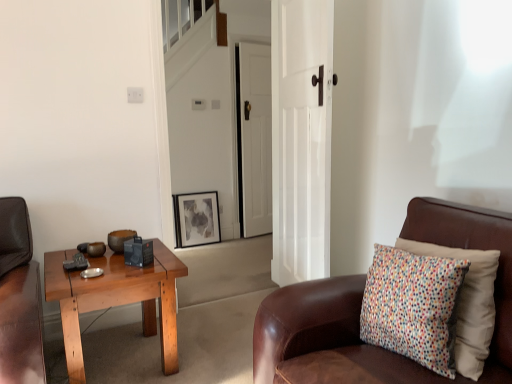
Question: Would you say white wooden door at center, which is the 2th door in front-to-back order, is a long distance from white glossy door at center, placed as the 2th door when sorted from back to front?

Choices:
 (A) yes
 (B) no

Answer: (A)

Question: Is white wooden door at center, which appears as the first door when viewed from the back, placed right next to white glossy door at center, positioned as the first door in front-to-back order?

Choices:
 (A) no
 (B) yes

Answer: (A)

Question: From the image's perspective, is white wooden door at center, which appears as the first door when viewed from the back, on top of white glossy door at center, positioned as the first door in front-to-back order?

Choices:
 (A) no
 (B) yes

Answer: (B)

Question: Is the position of white wooden door at center, which is the 2th door in front-to-back order, less distant than that of white glossy door at center, positioned as the first door in front-to-back order?

Choices:
 (A) yes
 (B) no

Answer: (B)

Question: From the image's perspective, is white wooden door at center, which is the 2th door in front-to-back order, under white glossy door at center, placed as the 2th door when sorted from back to front?

Choices:
 (A) no
 (B) yes

Answer: (A)

Question: Considering the relative sizes of white wooden door at center, which is the 2th door in front-to-back order, and white glossy door at center, positioned as the first door in front-to-back order, in the image provided, is white wooden door at center, which is the 2th door in front-to-back order, taller than white glossy door at center, positioned as the first door in front-to-back order,?

Choices:
 (A) yes
 (B) no

Answer: (B)

Question: Is matte black picture frame at center far away from white wooden door at center, which appears as the first door when viewed from the back?

Choices:
 (A) no
 (B) yes

Answer: (A)

Question: Is matte black picture frame at center at the left side of white wooden door at center, which appears as the first door when viewed from the back?

Choices:
 (A) no
 (B) yes

Answer: (B)

Question: Is matte black picture frame at center positioned behind white wooden door at center, which appears as the first door when viewed from the back?

Choices:
 (A) no
 (B) yes

Answer: (B)

Question: Is matte black picture frame at center outside white wooden door at center, which is the 2th door in front-to-back order?

Choices:
 (A) yes
 (B) no

Answer: (A)

Question: From the image's perspective, is matte black picture frame at center on top of white wooden door at center, which appears as the first door when viewed from the back?

Choices:
 (A) yes
 (B) no

Answer: (B)

Question: Is matte black picture frame at center positioned in front of white wooden door at center, which appears as the first door when viewed from the back?

Choices:
 (A) yes
 (B) no

Answer: (B)

Question: Does matte black picture frame at center have a greater height compared to brown leather chair at right?

Choices:
 (A) no
 (B) yes

Answer: (A)